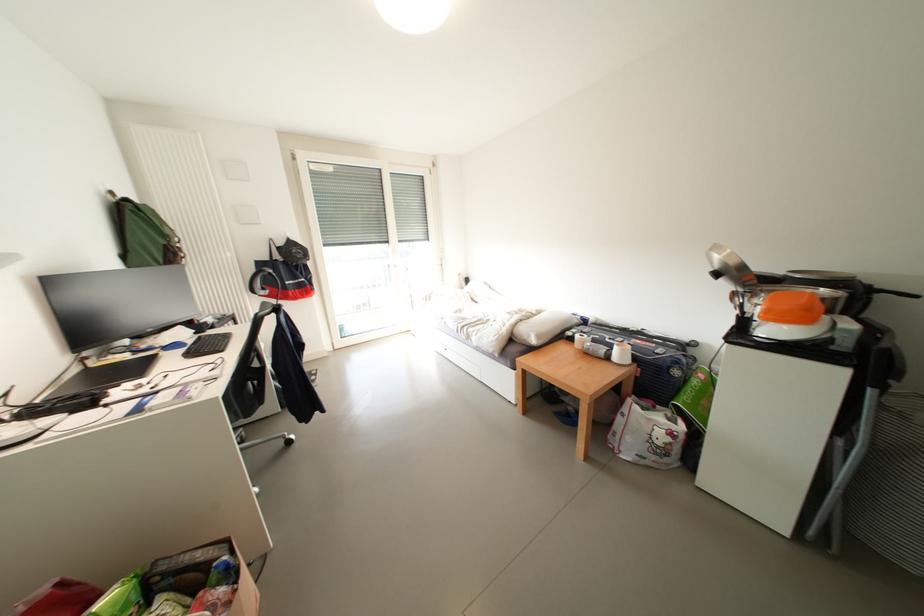
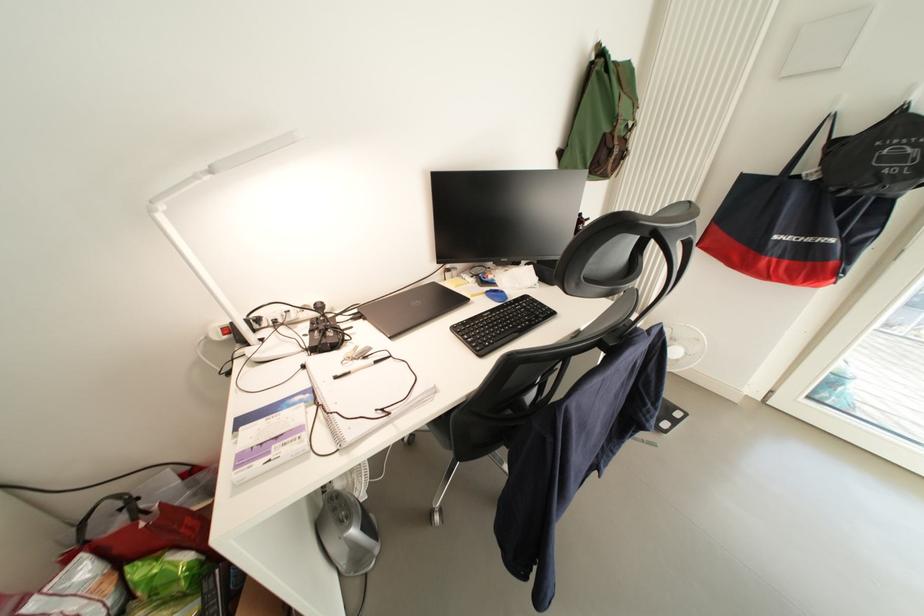
Where in the second image is the point corresponding to point 181,349 from the first image?

(503, 297)